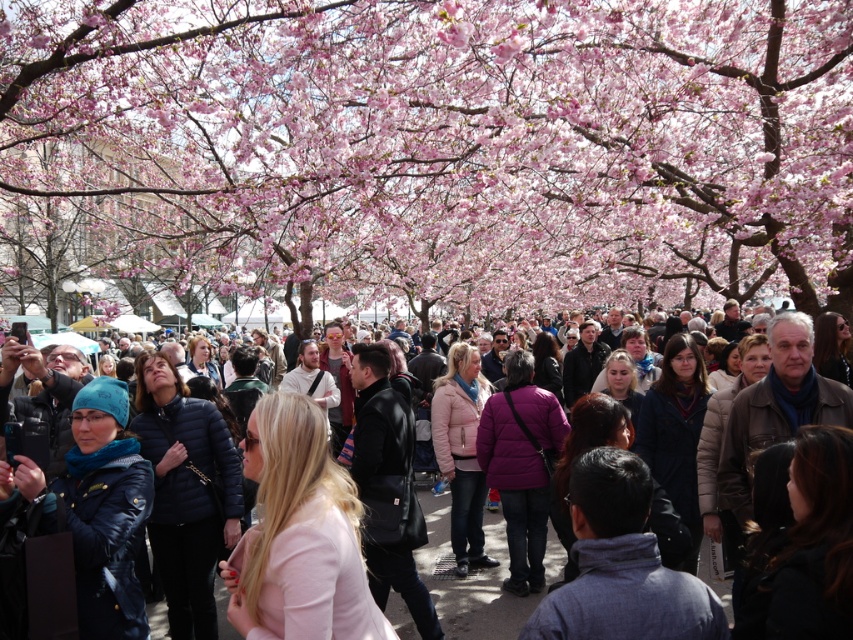
You are standing in the cherry blossom garden and see two points marked in the image. Which point is closer to you, point (428, 33) or point (426, 493)?

Point (426, 493) is closer to you because it is less further to the camera than point (428, 33).

You are a photographer standing in the crowd and want to take a photo of both the pink blossoms at center and the matte black jacket at center. Which object is closer to your camera lens?

The pink blossoms at center are closer to the camera lens because they are further to the viewer than the matte black jacket at center, meaning they appear nearer in the scene.